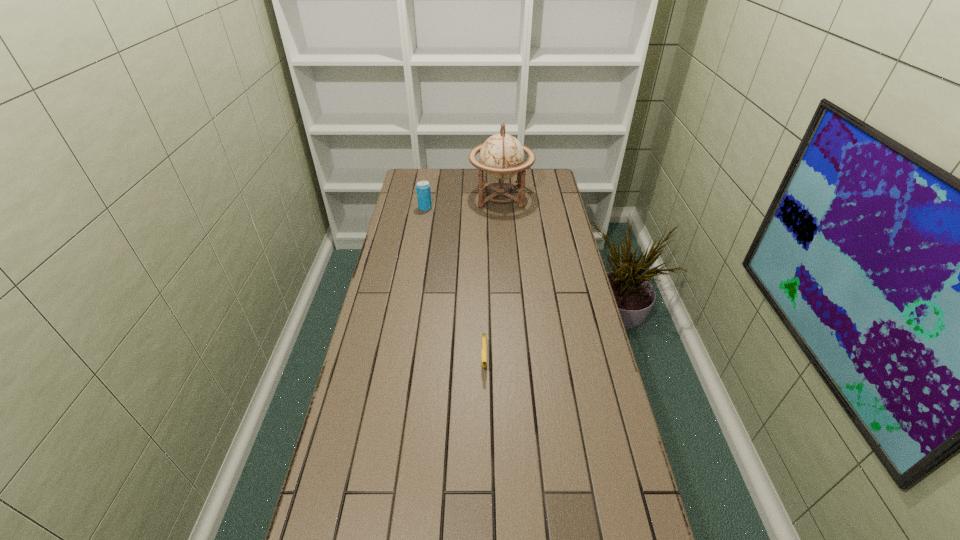
I want to click on free space that is in between the leftmost object and the nearest object, so click(x=455, y=284).

Where is `vacant space in between the tallest object and the leftmost object`? vacant space in between the tallest object and the leftmost object is located at coordinates (463, 202).

Choose which object is the second nearest neighbor to the nearest object. Please provide its 2D coordinates. Your answer should be formatted as a tuple, i.e. [(x, y)], where the tuple contains the x and y coordinates of a point satisfying the conditions above.

[(423, 187)]

Select which object appears as the second closest to the tallest object. Please provide its 2D coordinates. Your answer should be formatted as a tuple, i.e. [(x, y)], where the tuple contains the x and y coordinates of a point satisfying the conditions above.

[(484, 342)]

Locate an element on the screen. Image resolution: width=960 pixels, height=540 pixels. vacant space that satisfies the following two spatial constraints: 1. at the front of the globe showing Africa; 2. at the stem of the banana is located at coordinates (512, 360).

What are the coordinates of `vacant space that satisfies the following two spatial constraints: 1. at the front of the globe showing Africa; 2. at the stem of the shortest object` in the screenshot? It's located at coord(512,360).

Where is `free space in the image that satisfies the following two spatial constraints: 1. at the front of the globe showing Africa; 2. at the stem of the nearest object`? The image size is (960, 540). free space in the image that satisfies the following two spatial constraints: 1. at the front of the globe showing Africa; 2. at the stem of the nearest object is located at coordinates (512, 360).